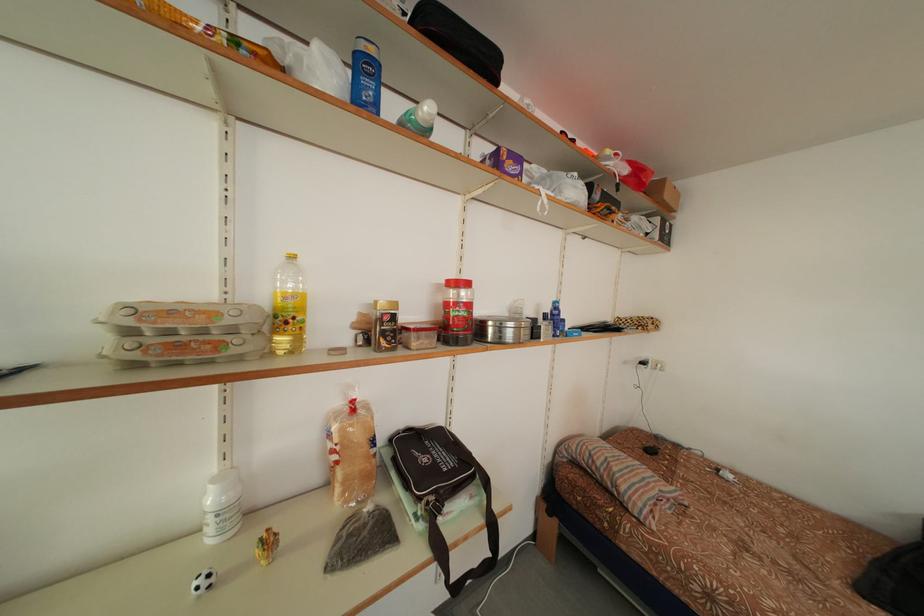
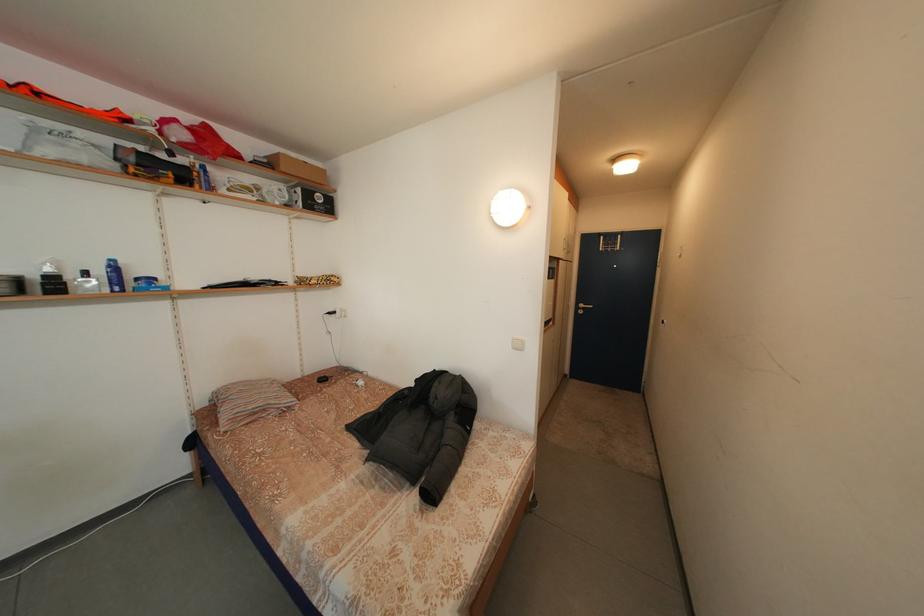
Find the pixel in the second image that matches [664,225] in the first image.

(307, 196)